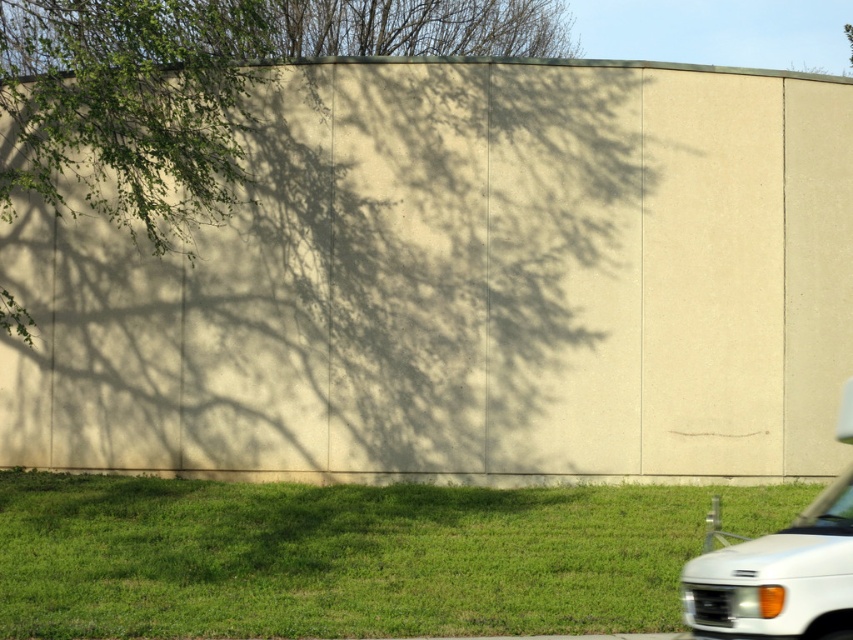
Which is more to the right, green leafy branches at upper left or white matte van at lower right?

white matte van at lower right is more to the right.

Who is positioned more to the left, green leafy branches at upper left or white matte van at lower right?

Positioned to the left is green leafy branches at upper left.

Between point (3, 161) and point (776, 620), which one is positioned in front?

Point (776, 620) is more forward.

I want to click on green leafy branches at upper left, so click(x=128, y=108).

Does green grass at lower right appear on the right side of white matte van at lower right?

No, green grass at lower right is not to the right of white matte van at lower right.

Is green grass at lower right shorter than white matte van at lower right?

Indeed, green grass at lower right has a lesser height compared to white matte van at lower right.

Who is more distant from viewer, (607, 573) or (715, 636)?

The point (607, 573) is behind.

Where is `green grass at lower right`? This screenshot has height=640, width=853. green grass at lower right is located at coordinates (351, 556).

The width and height of the screenshot is (853, 640). In order to click on green leafy tree at upper left in this screenshot , I will do `click(198, 88)`.

Is green leafy tree at upper left to the left of white matte van at lower right from the viewer's perspective?

Yes, green leafy tree at upper left is to the left of white matte van at lower right.

Does point (550, 13) come farther from viewer compared to point (840, 604)?

Yes.

I want to click on green leafy tree at upper left, so click(x=198, y=88).